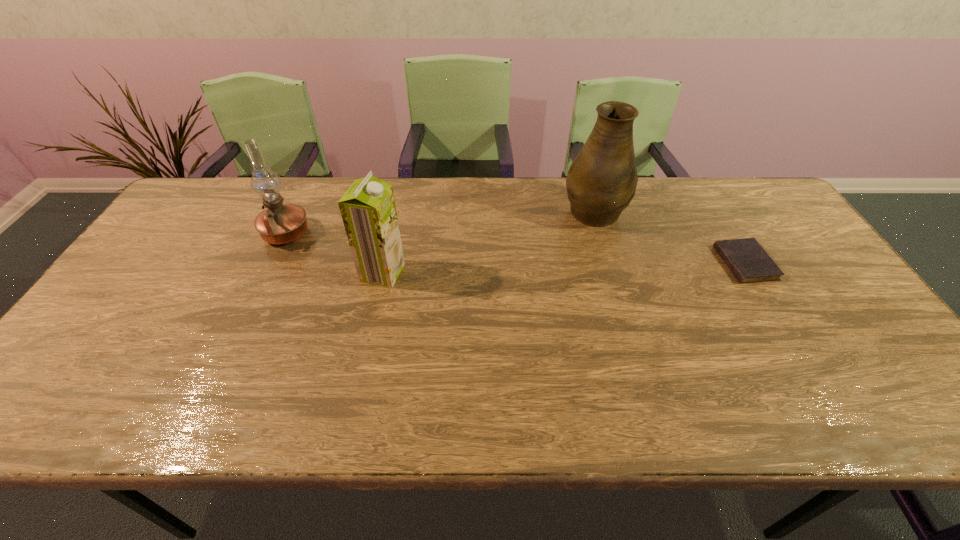
Find the location of a particular element. This screenshot has width=960, height=540. pitcher at the far edge is located at coordinates (601, 182).

Find the location of a particular element. oil lamp at the far edge is located at coordinates (279, 224).

You are a GUI agent. You are given a task and a screenshot of the screen. Output one action in this format:
    pyautogui.click(x=<x>, y=<y>)
    Task: Click on the object located in the right edge section of the desktop
    Image resolution: width=960 pixels, height=540 pixels.
    Given the screenshot: What is the action you would take?
    pyautogui.click(x=748, y=261)

Locate an element on the screen. The width and height of the screenshot is (960, 540). vacant space at the far edge is located at coordinates (683, 221).

Where is `vacant space at the near edge of the desktop`? Image resolution: width=960 pixels, height=540 pixels. vacant space at the near edge of the desktop is located at coordinates (203, 397).

What are the coordinates of `free space at the left edge` in the screenshot? It's located at (173, 264).

What are the coordinates of `free space at the right edge` in the screenshot? It's located at (864, 384).

The height and width of the screenshot is (540, 960). Find the location of `free point between the pitcher and the third object from right to left`. free point between the pitcher and the third object from right to left is located at coordinates (488, 241).

The width and height of the screenshot is (960, 540). In order to click on vacant point located between the diary and the soya milk in this screenshot , I will do `click(564, 268)`.

Locate an element on the screen. unoccupied area between the third object from right to left and the shortest object is located at coordinates (564, 268).